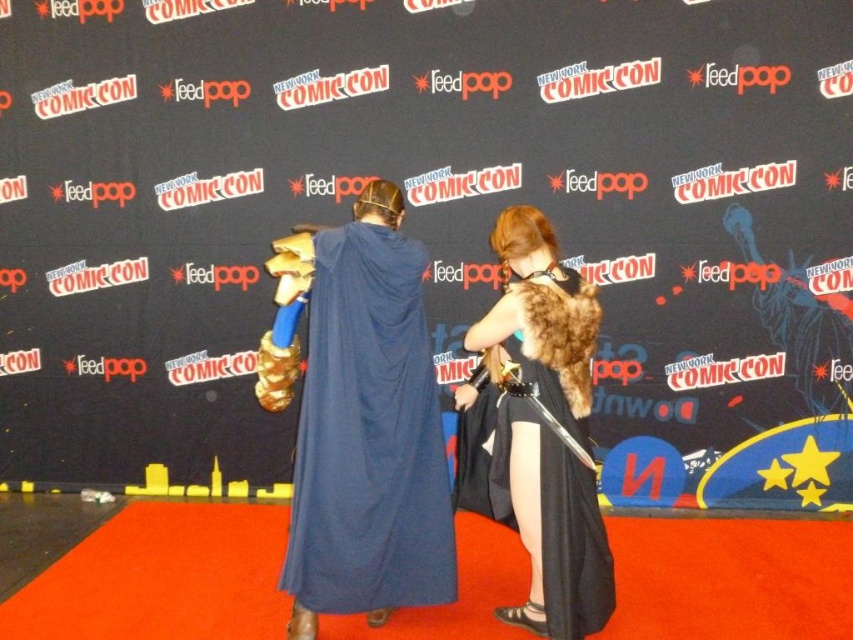
Who is lower down, blue drapery at center or fur-coated cape at center?

fur-coated cape at center is lower down.

Is blue drapery at center further to camera compared to fur-coated cape at center?

That is True.

Who is more distant from viewer, (378, 234) or (566, 280)?

Positioned behind is point (378, 234).

Image resolution: width=853 pixels, height=640 pixels. What are the coordinates of `blue drapery at center` in the screenshot? It's located at (368, 435).